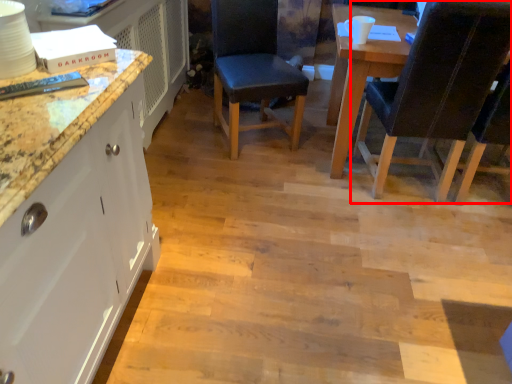
Question: From the image's perspective, where is chair (annotated by the red box) located relative to chair?

Choices:
 (A) above
 (B) below

Answer: (B)